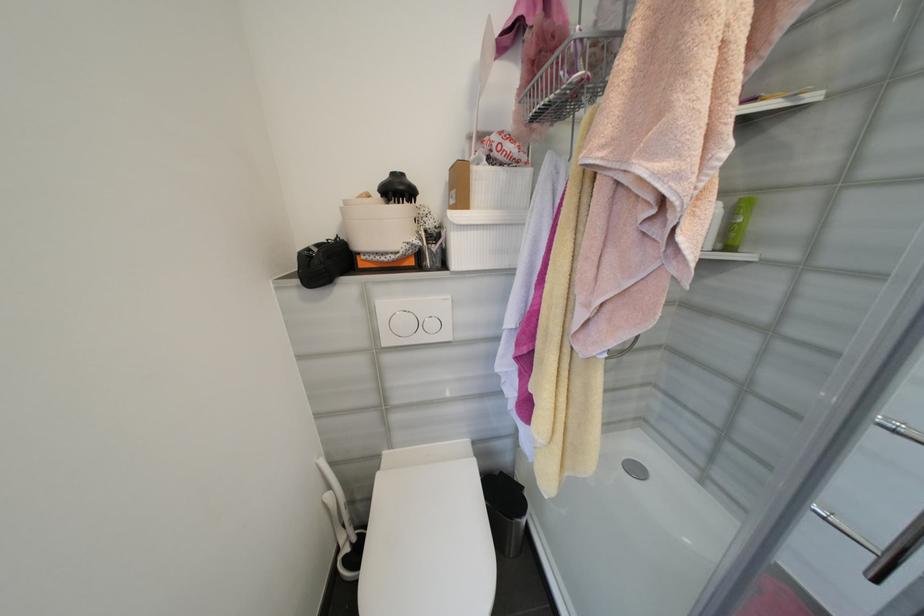
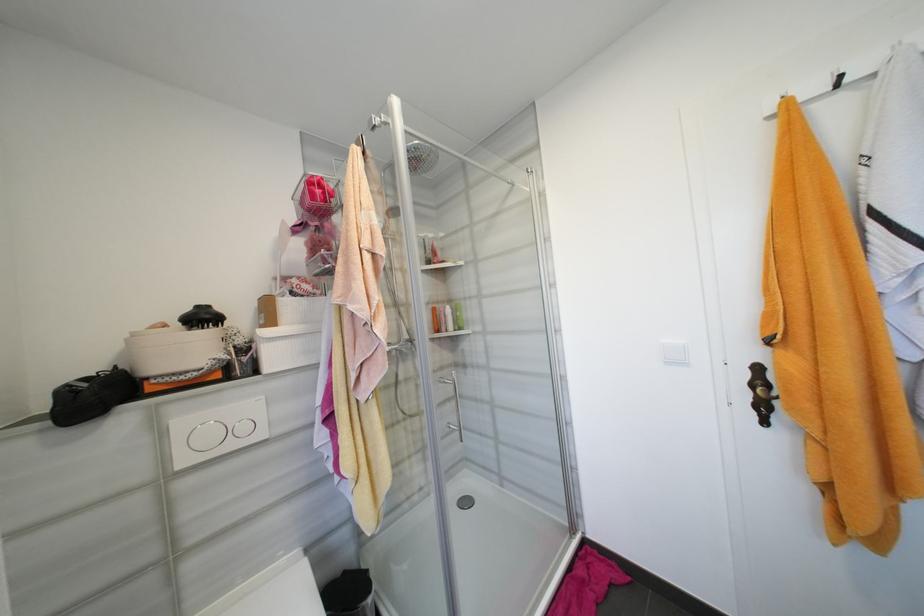
Find the pixel in the second image that matches the point at 732,208 in the first image.

(457, 309)